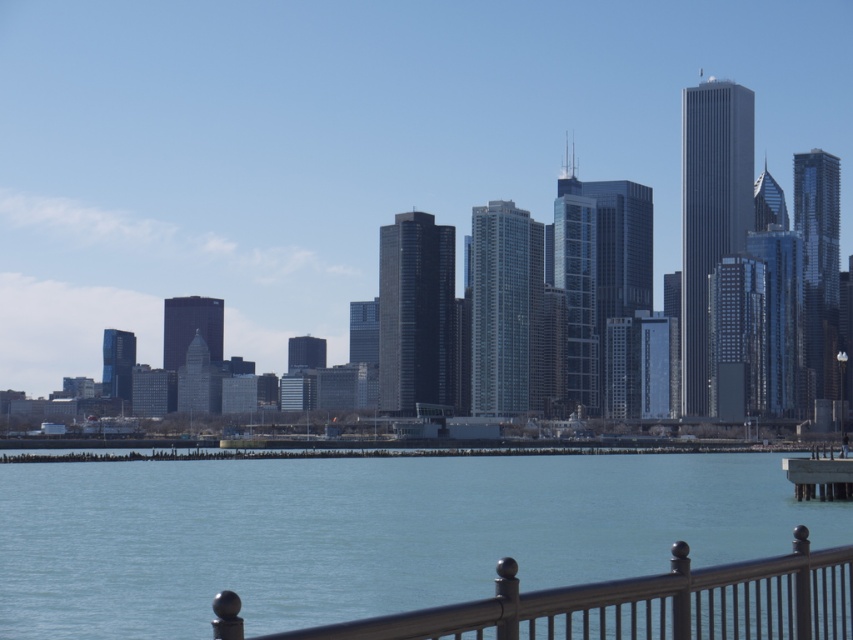
Question: Can you confirm if clear blue water at lower center is smaller than gray concrete dock at lower right?

Choices:
 (A) yes
 (B) no

Answer: (B)

Question: Based on their relative distances, which object is farther from the gray concrete dock at lower right?

Choices:
 (A) metallic gray railing at lower center
 (B) clear blue water at lower center

Answer: (A)

Question: Estimate the real-world distances between objects in this image. Which object is farther from the gray concrete dock at lower right?

Choices:
 (A) metallic gray railing at lower center
 (B) clear blue water at lower center

Answer: (A)

Question: Is clear blue water at lower center bigger than gray concrete dock at lower right?

Choices:
 (A) yes
 (B) no

Answer: (A)

Question: Which point appears closest to the camera in this image?

Choices:
 (A) (764, 634)
 (B) (837, 484)
 (C) (463, 584)

Answer: (A)

Question: Is clear blue water at lower center further to camera compared to gray concrete dock at lower right?

Choices:
 (A) yes
 (B) no

Answer: (B)